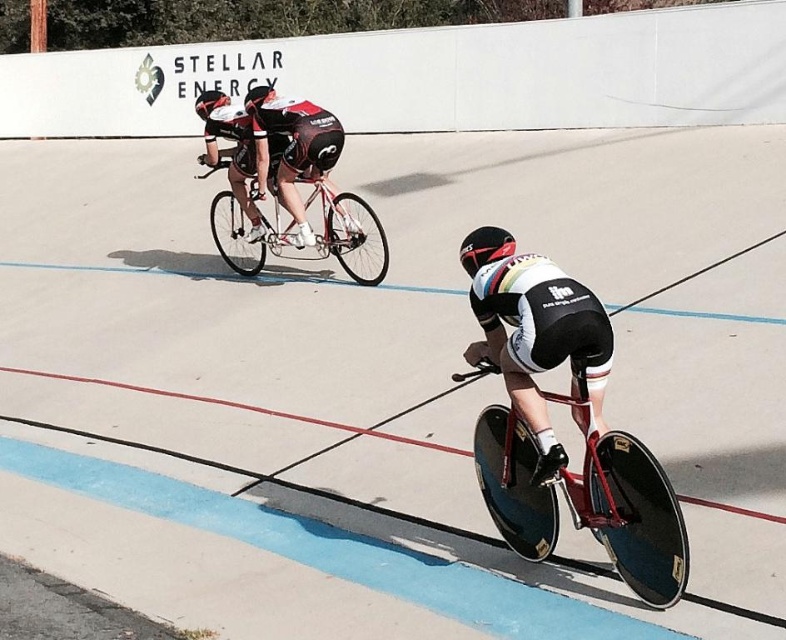
Is point (601, 368) farther from camera compared to point (472, 266)?

That is False.

From the picture: Who is positioned more to the right, shiny black bicycle at center or black matte helmet at center?

shiny black bicycle at center is more to the right.

Between point (564, 275) and point (458, 256), which one is positioned behind?

The point (458, 256) is behind.

You are a GUI agent. You are given a task and a screenshot of the screen. Output one action in this format:
    pyautogui.click(x=<x>, y=<y>)
    Task: Click on the shiny black bicycle at center
    
    Given the screenshot: What is the action you would take?
    pyautogui.click(x=533, y=330)

Does shiny red bike at lower right lie behind shiny black bicycle at center?

No, shiny red bike at lower right is closer to the viewer.

Between shiny red bike at lower right and shiny black bicycle at center, which one has less height?

shiny red bike at lower right is shorter.

Find the location of a particular element. The image size is (786, 640). shiny red bike at lower right is located at coordinates (586, 502).

Image resolution: width=786 pixels, height=640 pixels. In order to click on shiny red bike at lower right in this screenshot , I will do `click(586, 502)`.

Does shiny red bike at lower right appear under shiny metallic bicycle at center?

Correct, shiny red bike at lower right is located below shiny metallic bicycle at center.

Is shiny red bike at lower right closer to camera compared to shiny metallic bicycle at center?

Yes, shiny red bike at lower right is in front of shiny metallic bicycle at center.

What do you see at coordinates (586, 502) in the screenshot? I see `shiny red bike at lower right` at bounding box center [586, 502].

Locate an element on the screen. This screenshot has width=786, height=640. shiny red bike at lower right is located at coordinates (586, 502).